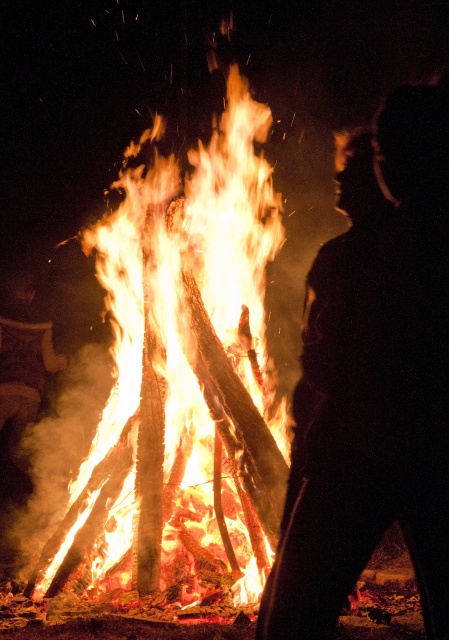
Who is positioned more to the right, silhouette figure at center or bright orange wood at center?

silhouette figure at center is more to the right.

Between point (369, 445) and point (233, 128), which one is positioned behind?

The point (233, 128) is behind.

You are a GUI agent. You are given a task and a screenshot of the screen. Output one action in this format:
    pyautogui.click(x=<x>, y=<y>)
    Task: Click on the silhouette figure at center
    
    Given the screenshot: What is the action you would take?
    pyautogui.click(x=373, y=380)